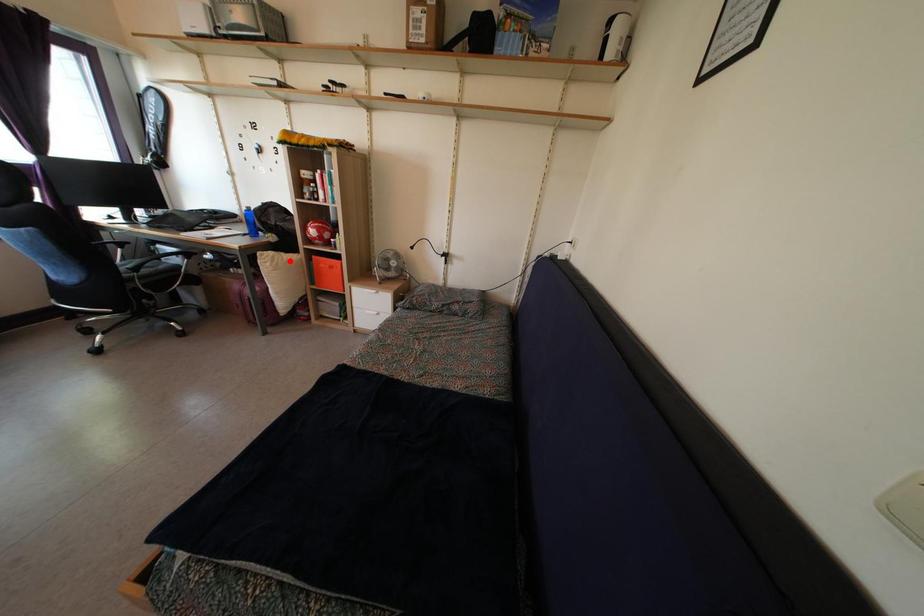
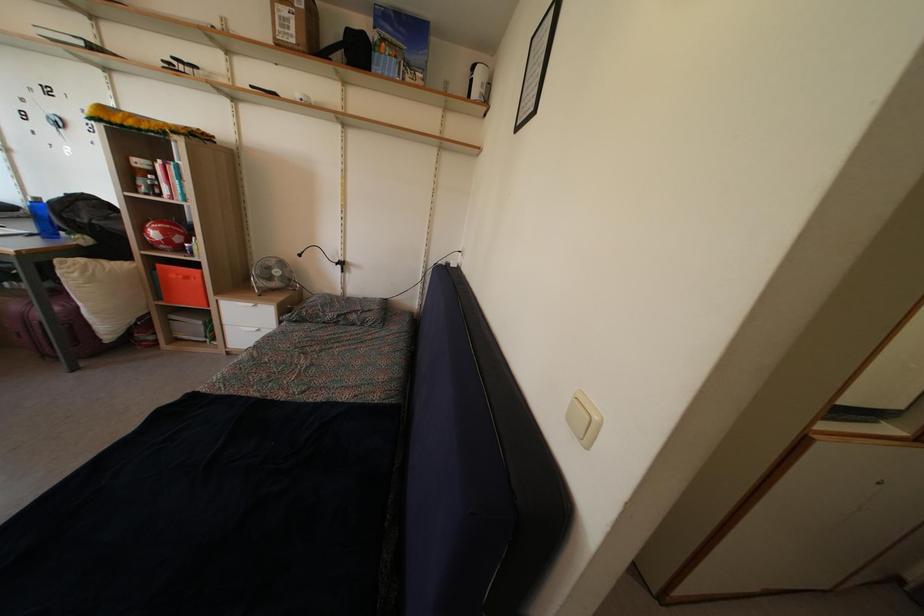
Question: I am providing you with two images of the same scene from different viewpoints. Image1 has a red point marked. In image2, the corresponding 3D location appears at what relative position? Reply with the corresponding letter.

Choices:
 (A) Closer
 (B) Farther

Answer: (B)